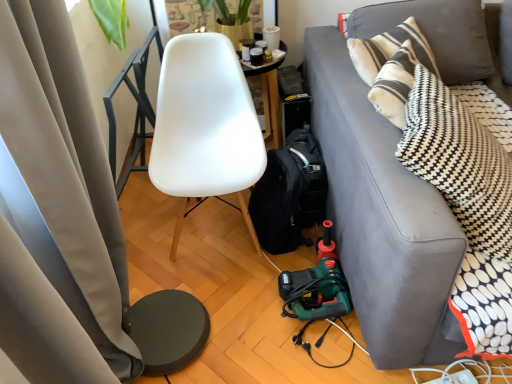
Question: From the image's perspective, is matte gray curtain at left positioned above or below white matte chair at center?

Choices:
 (A) below
 (B) above

Answer: (A)

Question: Considering the positions of matte gray curtain at left and white matte chair at center in the image, is matte gray curtain at left wider or thinner than white matte chair at center?

Choices:
 (A) wide
 (B) thin

Answer: (B)

Question: Which object is positioned farthest from the gray fabric couch at right?

Choices:
 (A) matte gray curtain at left
 (B) white matte chair at center
 (C) white plastic power outlet at lower right
 (D) black fabric backpack at lower center

Answer: (A)

Question: Which object is the farthest from the gray fabric couch at right?

Choices:
 (A) black fabric backpack at lower center
 (B) white plastic power outlet at lower right
 (C) white matte chair at center
 (D) matte gray curtain at left

Answer: (D)